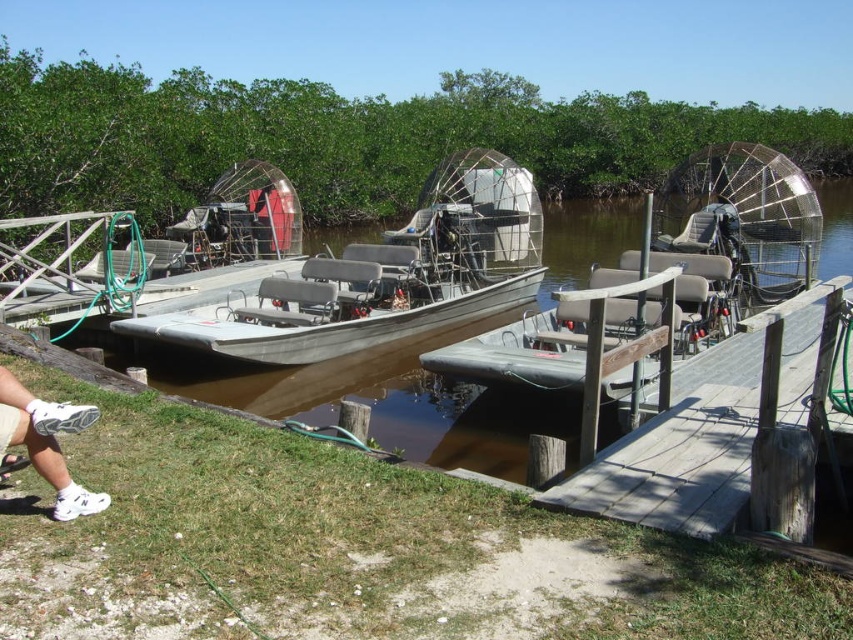
Does gray metallic boat at center appear on the left side of white fabric shoe at lower left?

In fact, gray metallic boat at center is to the right of white fabric shoe at lower left.

Does point (483, 330) lie behind point (30, 433)?

Yes, point (483, 330) is farther from viewer.

Does point (544, 429) come behind point (9, 410)?

Yes, it is.

You are a GUI agent. You are given a task and a screenshot of the screen. Output one action in this format:
    pyautogui.click(x=<x>, y=<y>)
    Task: Click on the gray metallic boat at center
    
    Given the screenshot: What is the action you would take?
    pyautogui.click(x=372, y=397)

In the scene shown: Is silver metallic airboat at center below wooden dock at center?

No.

From the picture: Between silver metallic airboat at center and wooden dock at center, which one appears on the left side from the viewer's perspective?

From the viewer's perspective, silver metallic airboat at center appears more on the left side.

Who is more forward, [352,282] or [653,490]?

Point [653,490] is in front.

Where is `silver metallic airboat at center`? silver metallic airboat at center is located at coordinates (386, 275).

Identify the location of silver metallic airboat at center. The height and width of the screenshot is (640, 853). (386, 275).

Measure the distance between silver metallic airboat at center and white fabric shoe at lower left.

silver metallic airboat at center and white fabric shoe at lower left are 8.82 meters apart from each other.

Does point (457, 296) come farther from viewer compared to point (62, 515)?

Yes, it is.

Find the location of a particular element. The width and height of the screenshot is (853, 640). silver metallic airboat at center is located at coordinates click(386, 275).